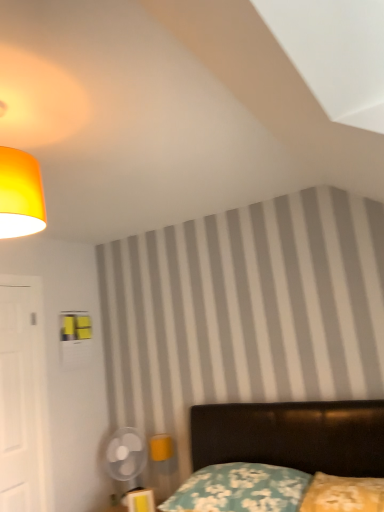
Question: Can you confirm if matte yellow lampshade at upper left is taller than velvet black bed at lower right?

Choices:
 (A) no
 (B) yes

Answer: (A)

Question: From a real-world perspective, is matte yellow lampshade at upper left located higher than velvet black bed at lower right?

Choices:
 (A) no
 (B) yes

Answer: (B)

Question: Is matte yellow lampshade at upper left further to camera compared to velvet black bed at lower right?

Choices:
 (A) no
 (B) yes

Answer: (B)

Question: From the image's perspective, is matte yellow lampshade at upper left on velvet black bed at lower right?

Choices:
 (A) yes
 (B) no

Answer: (A)

Question: Would you say matte yellow lampshade at upper left is outside velvet black bed at lower right?

Choices:
 (A) no
 (B) yes

Answer: (B)

Question: From the image's perspective, relative to floral fabric pillow at lower center, which ranks as the 1th pillow in left-to-right order, is white matte door at left above or below?

Choices:
 (A) below
 (B) above

Answer: (B)

Question: Considering their positions, is white matte door at left located in front of or behind floral fabric pillow at lower center, which ranks as the 2th pillow in right-to-left order?

Choices:
 (A) front
 (B) behind

Answer: (B)

Question: Is point (23, 466) closer or farther from the camera than point (216, 472)?

Choices:
 (A) closer
 (B) farther

Answer: (B)

Question: In terms of height, does white matte door at left look taller or shorter compared to floral fabric pillow at lower center, which ranks as the 1th pillow in left-to-right order?

Choices:
 (A) short
 (B) tall

Answer: (B)

Question: Based on their sizes in the image, would you say matte yellow lampshade at upper left is bigger or smaller than floral fabric pillow at lower center, which ranks as the 2th pillow in right-to-left order?

Choices:
 (A) big
 (B) small

Answer: (B)

Question: Considering the relative positions of matte yellow lampshade at upper left and floral fabric pillow at lower center, which ranks as the 1th pillow in left-to-right order, in the image provided, is matte yellow lampshade at upper left to the left or to the right of floral fabric pillow at lower center, which ranks as the 1th pillow in left-to-right order,?

Choices:
 (A) right
 (B) left

Answer: (B)

Question: Is matte yellow lampshade at upper left taller or shorter than floral fabric pillow at lower center, which ranks as the 1th pillow in left-to-right order?

Choices:
 (A) short
 (B) tall

Answer: (B)

Question: From the image's perspective, is matte yellow lampshade at upper left above or below floral fabric pillow at lower center, which ranks as the 1th pillow in left-to-right order?

Choices:
 (A) below
 (B) above

Answer: (B)

Question: From the image's perspective, is transparent plastic fan at lower left located above or below floral fabric pillow at lower center, which ranks as the 1th pillow in left-to-right order?

Choices:
 (A) below
 (B) above

Answer: (A)

Question: In terms of width, does transparent plastic fan at lower left look wider or thinner when compared to floral fabric pillow at lower center, which ranks as the 1th pillow in left-to-right order?

Choices:
 (A) thin
 (B) wide

Answer: (A)